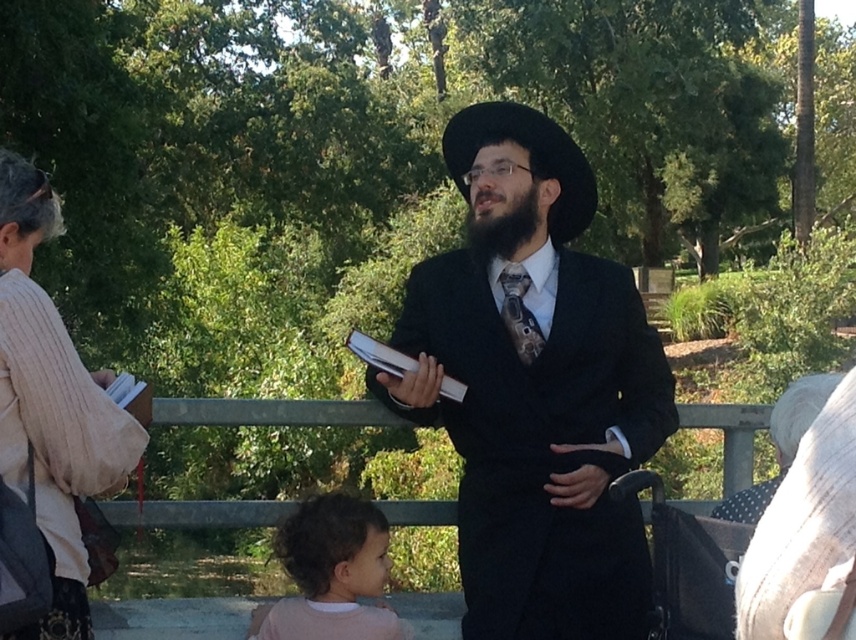
Question: Does curly hair at lower left appear on the left side of black matte beard at center?

Choices:
 (A) yes
 (B) no

Answer: (A)

Question: Which object is positioned closest to the matte black suit at center?

Choices:
 (A) black matte beard at center
 (B) dark gray textured tie at center
 (C) curly hair at lower left
 (D) black felt hat at center

Answer: (B)

Question: Based on their relative distances, which object is farther from the black felt hat at center?

Choices:
 (A) matte black suit at center
 (B) dark gray textured tie at center
 (C) curly hair at lower left

Answer: (C)

Question: Which object is the closest to the curly hair at lower left?

Choices:
 (A) black felt hat at center
 (B) dark gray textured tie at center

Answer: (B)

Question: Does black felt hat at center have a lesser width compared to dark gray textured tie at center?

Choices:
 (A) no
 (B) yes

Answer: (A)

Question: Can you confirm if curly hair at lower left is positioned to the right of black felt hat at center?

Choices:
 (A) no
 (B) yes

Answer: (A)